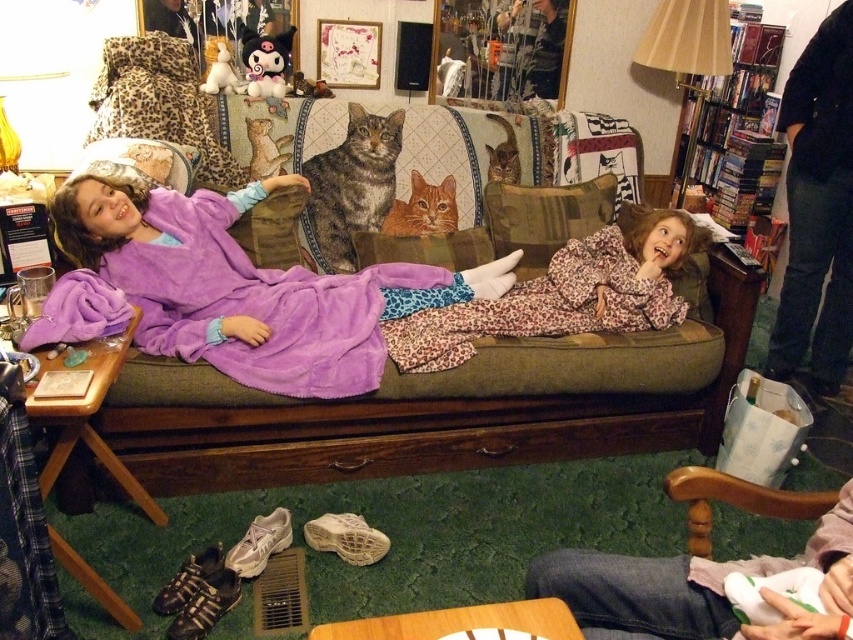
Question: Can you confirm if white fabric at lower right is positioned to the right of wooden bookshelf at upper right?

Choices:
 (A) yes
 (B) no

Answer: (B)

Question: Which object is positioned closest to the purple fleece blanket at center?

Choices:
 (A) leopard print pillow at center
 (B) velvet green couch at center
 (C) leopard print blanket at center
 (D) brown textured pillow at center

Answer: (B)

Question: Which object is farther from the camera taking this photo?

Choices:
 (A) purple fleece blanket at center
 (B) white fabric at lower right
 (C) brown textured pillow at center

Answer: (C)

Question: Is leopard print blanket at center positioned before wooden bookshelf at upper right?

Choices:
 (A) no
 (B) yes

Answer: (B)

Question: Is velvet green couch at center positioned at the back of leopard print pillow at center?

Choices:
 (A) yes
 (B) no

Answer: (B)

Question: Which point is farther to the camera?

Choices:
 (A) white fabric at lower right
 (B) leopard print blanket at center
 (C) wooden bookshelf at upper right

Answer: (C)